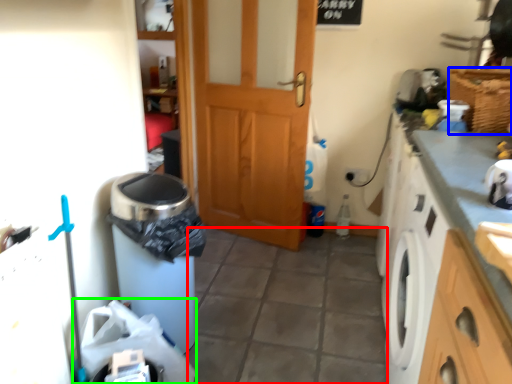
Question: Based on their relative distances, which object is nearer to tile (highlighted by a red box)? Choose from basket (highlighted by a blue box) and garbage (highlighted by a green box).

Choices:
 (A) basket
 (B) garbage

Answer: (B)